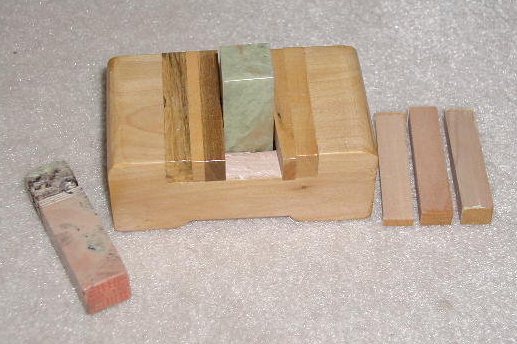
Identify the location of marble. (244, 85).